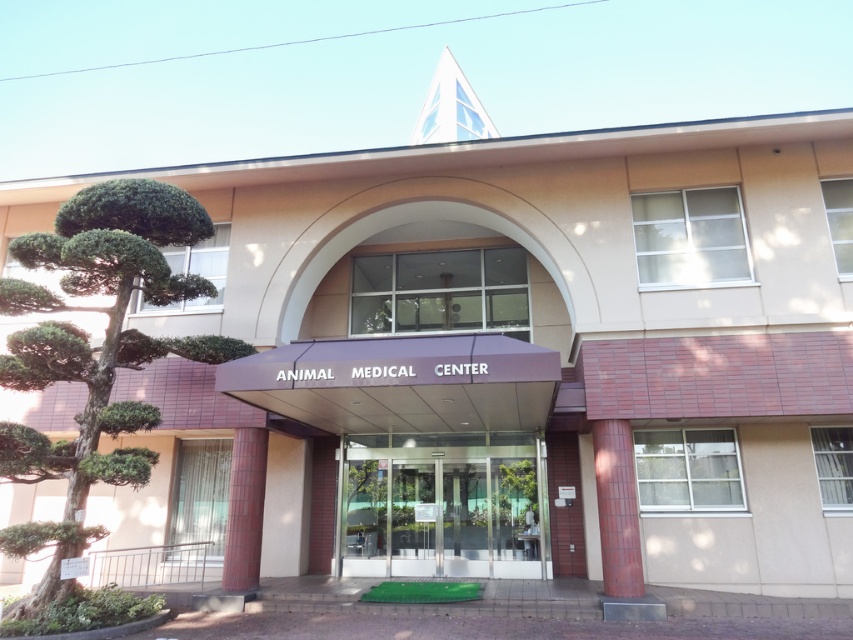
You are a delivery person trying to park your van which is 1.5 meters wide. You see the green leafy tree at left and the transparent glass door at center. Can you fit your van between them without hitting either? Explain your reasoning.

The green leafy tree at left has a lesser width compared to transparent glass door at center. Since the tree is narrower than the door, the total space between them would depend on their combined widths. However, the exact distance between the tree and the door isn not specified. Without knowing the actual spacing between the two objects, it is impossible to determine if the van will fit. Please check the actual distance on site.

You are standing at the entrance of the Animal Medical Center and want to water the green leafy tree at left. If your watering can has a maximum reach of 20 feet, will you be able to water the tree without moving closer?

The green leafy tree at left is 21.35 feet away from the viewer. Since the watering can has a maximum reach of 20 feet, you will not be able to water the tree without moving closer.

You are standing at the entrance of the Animal Medical Center and want to take a photo of the point marked at coordinates (138, 348). Considering the distance, will you need to zoom in or out to capture it clearly in your photo?

The point at coordinates (138, 348) is 8.41 meters away from the camera. To capture it clearly, you would need to zoom out to ensure the entire area around the point is in frame.